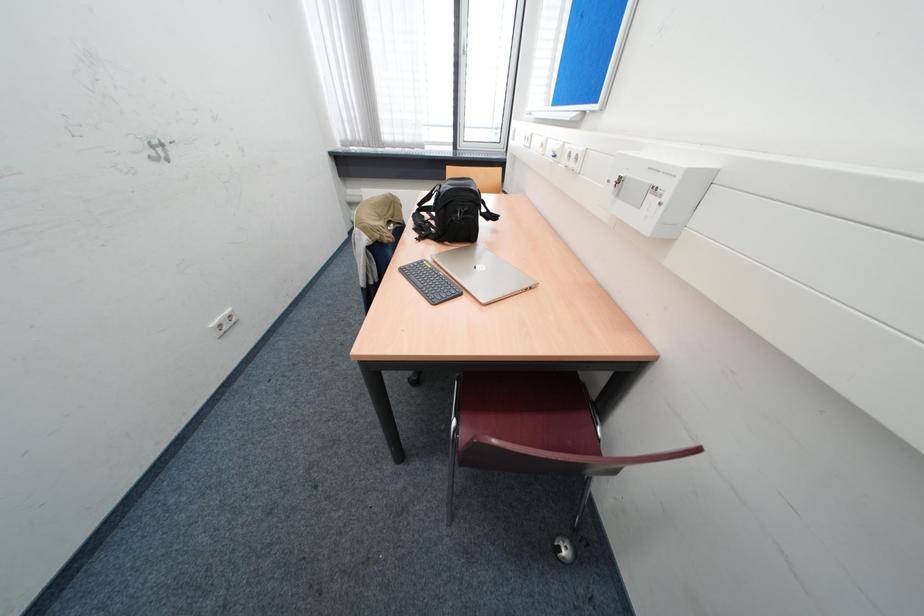
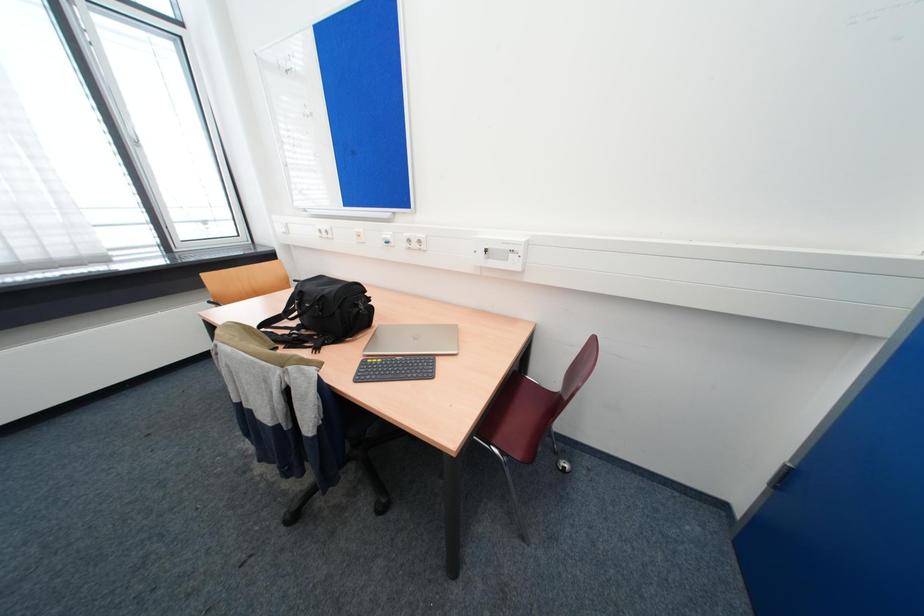
Question: The first image is from the beginning of the video and the second image is from the end. How did the camera likely rotate when shooting the video?

Choices:
 (A) Left
 (B) Right
 (C) Up
 (D) Down

Answer: (B)